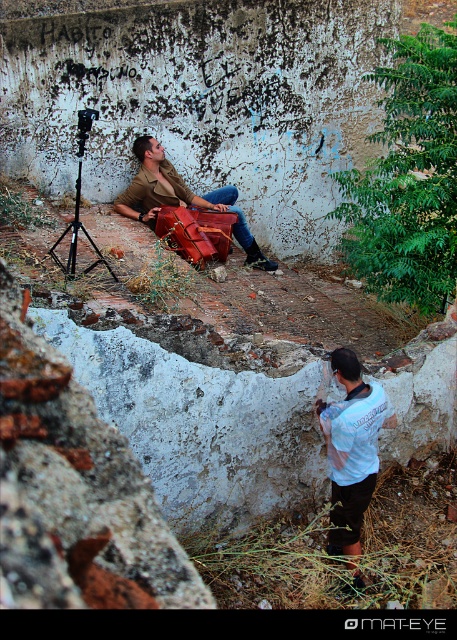
Question: Based on their relative distances, which object is farther from the white cotton shirt at lower right?

Choices:
 (A) leather suitcase at center
 (B) black matte tripod at center

Answer: (A)

Question: Is white cotton shirt at lower right above black matte tripod at center?

Choices:
 (A) no
 (B) yes

Answer: (A)

Question: Is white cotton shirt at lower right thinner than leather suitcase at center?

Choices:
 (A) yes
 (B) no

Answer: (A)

Question: Which point appears farthest from the camera in this image?

Choices:
 (A) (80, 109)
 (B) (145, 211)

Answer: (B)

Question: Which of the following is the closest to the observer?

Choices:
 (A) black matte tripod at center
 (B) white cotton shirt at lower right
 (C) leather suitcase at center

Answer: (B)

Question: Does leather suitcase at center have a greater width compared to black matte tripod at center?

Choices:
 (A) yes
 (B) no

Answer: (A)